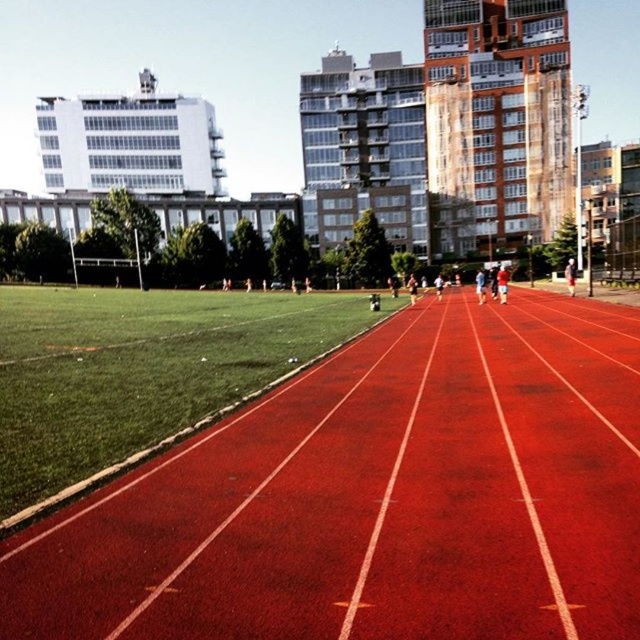
Is rubberized red track at center below red fabric shorts at center?

Yes, rubberized red track at center is below red fabric shorts at center.

Is rubberized red track at center wider than red fabric shorts at center?

No, rubberized red track at center is not wider than red fabric shorts at center.

Identify the location of rubberized red track at center. (376, 497).

This screenshot has width=640, height=640. I want to click on rubberized red track at center, so click(x=376, y=497).

Which of these two, red fabric shorts at center or smooth white shirt at center, stands taller?

red fabric shorts at center is taller.

Who is more forward, (570, 280) or (476, 289)?

Point (570, 280)

What do you see at coordinates (570, 275) in the screenshot?
I see `red fabric shorts at center` at bounding box center [570, 275].

Where is `red fabric shorts at center`? red fabric shorts at center is located at coordinates (570, 275).

Who is shorter, matte red track at center or smooth white shirt at center?

smooth white shirt at center is shorter.

At what (x,y) coordinates should I click in order to perform the action: click on matte red track at center. Please return your answer as a coordinate pair (x, y). This screenshot has width=640, height=640. Looking at the image, I should click on (x=502, y=282).